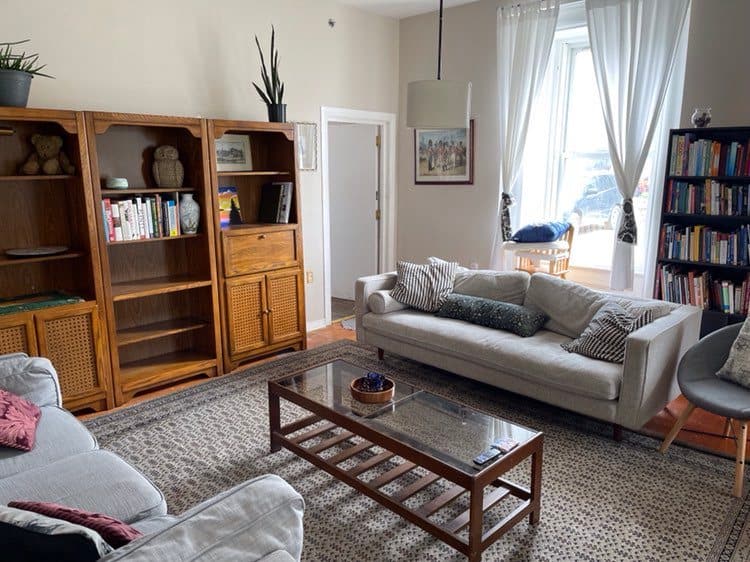
What are the coordinates of `window` in the screenshot? It's located at (588, 198).